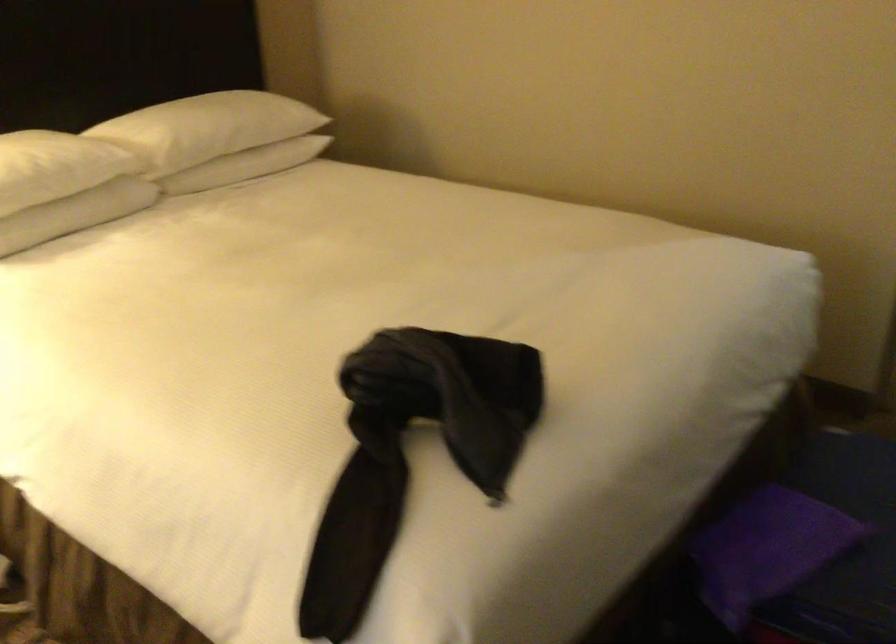
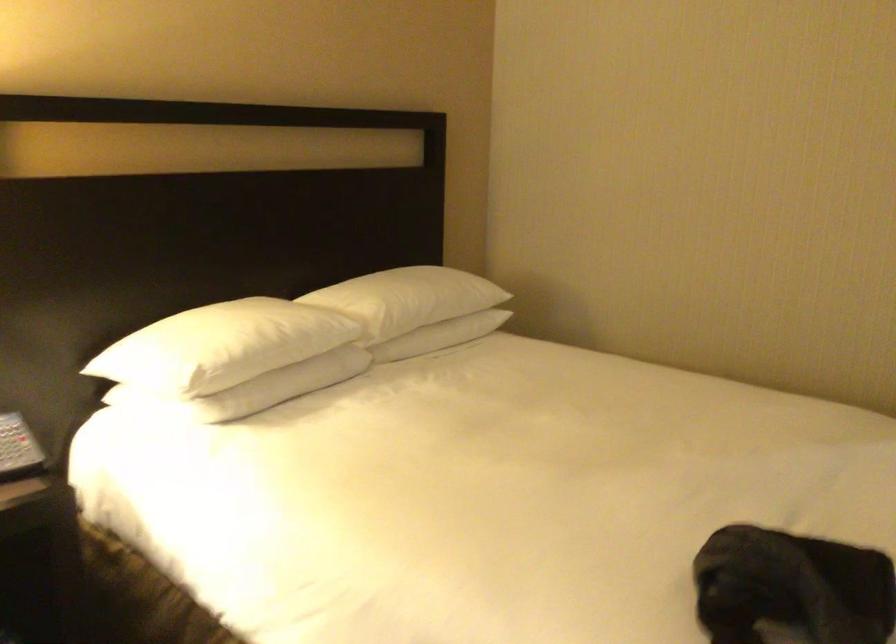
Where in the second image is the point corresponding to pixel 252 158 from the first image?

(443, 330)